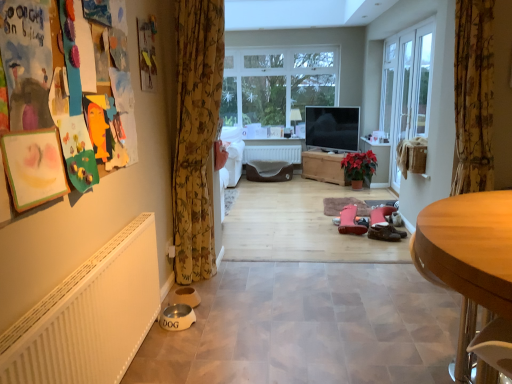
Question: Is red matte poinsettia at center closer to camera compared to floral fabric curtain at right, positioned as the second curtain in left-to-right order?

Choices:
 (A) yes
 (B) no

Answer: (B)

Question: Is red matte poinsettia at center positioned far away from floral fabric curtain at right, positioned as the second curtain in left-to-right order?

Choices:
 (A) no
 (B) yes

Answer: (B)

Question: Can you confirm if red matte poinsettia at center is wider than floral fabric curtain at right, the 1th curtain positioned from the right?

Choices:
 (A) yes
 (B) no

Answer: (A)

Question: Is red matte poinsettia at center touching floral fabric curtain at right, the 1th curtain positioned from the right?

Choices:
 (A) no
 (B) yes

Answer: (A)

Question: Can you confirm if red matte poinsettia at center is thinner than floral fabric curtain at right, positioned as the second curtain in left-to-right order?

Choices:
 (A) no
 (B) yes

Answer: (A)

Question: From a real-world perspective, is white glass screen door at right physically located above or below wooden desk at lower right?

Choices:
 (A) below
 (B) above

Answer: (B)

Question: From the image's perspective, is white glass screen door at right positioned above or below wooden desk at lower right?

Choices:
 (A) below
 (B) above

Answer: (B)

Question: Considering the positions of point (392, 119) and point (471, 279), is point (392, 119) closer or farther from the camera than point (471, 279)?

Choices:
 (A) farther
 (B) closer

Answer: (A)

Question: Considering their positions, is white glass screen door at right located in front of or behind wooden desk at lower right?

Choices:
 (A) behind
 (B) front

Answer: (A)

Question: In the image, is wooden chest at center on the left side or the right side of clear glass window at center?

Choices:
 (A) left
 (B) right

Answer: (B)

Question: Is wooden chest at center in front of or behind clear glass window at center in the image?

Choices:
 (A) front
 (B) behind

Answer: (A)

Question: From a real-world perspective, is wooden chest at center physically located above or below clear glass window at center?

Choices:
 (A) above
 (B) below

Answer: (B)

Question: From the image's perspective, relative to clear glass window at center, is wooden chest at center above or below?

Choices:
 (A) below
 (B) above

Answer: (A)

Question: Relative to pink suede boots at center, the first footwear from the back, is floral fabric curtain at right, the 1th curtain positioned from the right, in front or behind?

Choices:
 (A) front
 (B) behind

Answer: (A)

Question: Choose the correct answer: Is floral fabric curtain at right, the 1th curtain positioned from the right, inside pink suede boots at center, the first footwear from the back, or outside it?

Choices:
 (A) outside
 (B) inside

Answer: (A)